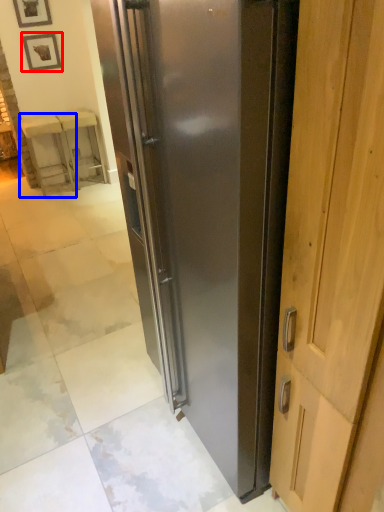
Question: Which object is closer to the camera taking this photo, picture frame (highlighted by a red box) or furniture (highlighted by a blue box)?

Choices:
 (A) picture frame
 (B) furniture

Answer: (A)